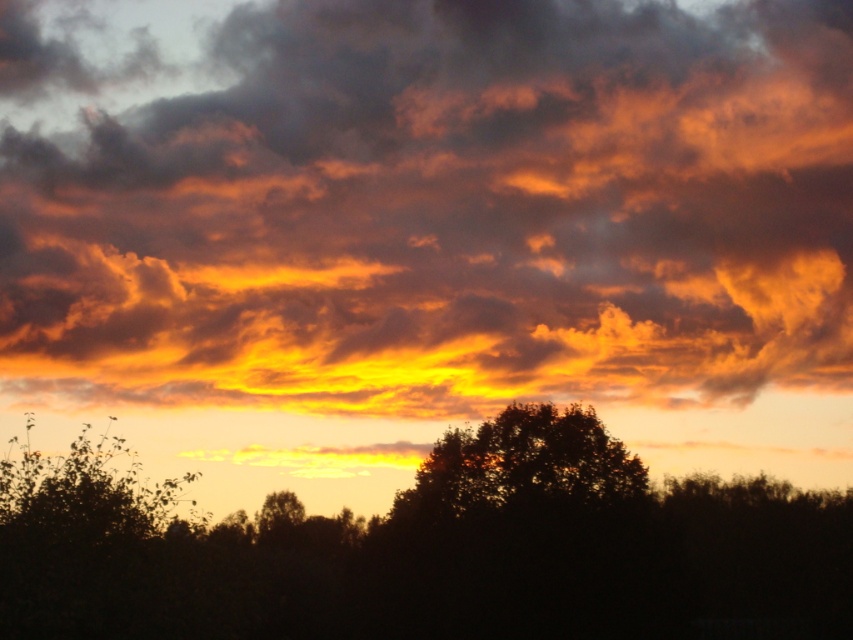
Question: In this image, where is orange cotton clouds at upper center located relative to silhouette tree at center?

Choices:
 (A) above
 (B) below

Answer: (A)

Question: Is orange cotton clouds at upper center to the right of silhouette tree at center from the viewer's perspective?

Choices:
 (A) no
 (B) yes

Answer: (B)

Question: In this image, where is orange cotton clouds at upper center located relative to silhouette tree at center?

Choices:
 (A) left
 (B) right

Answer: (B)

Question: Which of the following is the closest to the observer?

Choices:
 (A) (625, 200)
 (B) (285, 627)

Answer: (B)